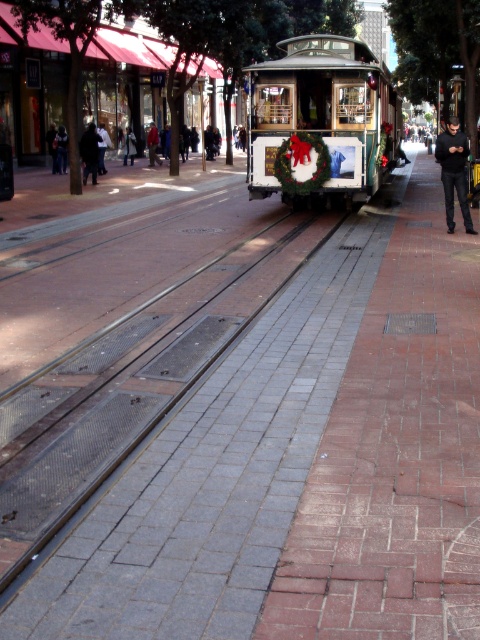
Question: Which object is positioned closest to the black fabric jacket at center?

Choices:
 (A) white wooden cable car at center
 (B) dark blue jeans at center
 (C) black matte pants at right
 (D) red jacket at center

Answer: (B)

Question: Which of the following is the closest to the observer?

Choices:
 (A) (84, 156)
 (B) (277, 173)
 (C) (62, 131)
 (D) (154, 156)

Answer: (B)

Question: Can you confirm if white wooden cable car at center is positioned to the right of black fabric jacket at center?

Choices:
 (A) yes
 (B) no

Answer: (A)

Question: Is black fabric jacket at center to the left of red jacket at center from the viewer's perspective?

Choices:
 (A) yes
 (B) no

Answer: (B)

Question: Which object appears farthest from the camera in this image?

Choices:
 (A) dark blue jeans at center
 (B) black matte pants at right

Answer: (A)

Question: Does white wooden cable car at center have a greater width compared to red jacket at center?

Choices:
 (A) no
 (B) yes

Answer: (B)